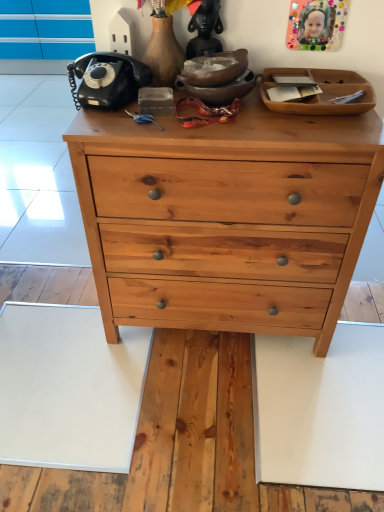
Question: Is matte black statue at upper center to the left of natural wood chest of drawers at center from the viewer's perspective?

Choices:
 (A) no
 (B) yes

Answer: (B)

Question: Considering the relative sizes of matte black statue at upper center and natural wood chest of drawers at center in the image provided, is matte black statue at upper center taller than natural wood chest of drawers at center?

Choices:
 (A) yes
 (B) no

Answer: (B)

Question: From the image's perspective, is matte black statue at upper center above natural wood chest of drawers at center?

Choices:
 (A) yes
 (B) no

Answer: (A)

Question: Can you confirm if matte black statue at upper center is smaller than natural wood chest of drawers at center?

Choices:
 (A) no
 (B) yes

Answer: (B)

Question: Is matte black statue at upper center positioned in front of natural wood chest of drawers at center?

Choices:
 (A) yes
 (B) no

Answer: (B)

Question: Is the surface of matte black statue at upper center in direct contact with natural wood chest of drawers at center?

Choices:
 (A) yes
 (B) no

Answer: (B)

Question: Does natural wood chest of drawers at center appear on the right side of matte black statue at upper center?

Choices:
 (A) no
 (B) yes

Answer: (B)

Question: Is the depth of natural wood chest of drawers at center less than that of matte black statue at upper center?

Choices:
 (A) no
 (B) yes

Answer: (B)

Question: Can you confirm if natural wood chest of drawers at center is wider than matte black statue at upper center?

Choices:
 (A) yes
 (B) no

Answer: (A)

Question: Can we say natural wood chest of drawers at center lies outside matte black statue at upper center?

Choices:
 (A) no
 (B) yes

Answer: (B)

Question: Is natural wood chest of drawers at center positioned far away from matte black statue at upper center?

Choices:
 (A) no
 (B) yes

Answer: (A)

Question: From a real-world perspective, is natural wood chest of drawers at center positioned over matte black statue at upper center based on gravity?

Choices:
 (A) no
 (B) yes

Answer: (A)

Question: From the image's perspective, is natural wood chest of drawers at center positioned above or below matte black statue at upper center?

Choices:
 (A) below
 (B) above

Answer: (A)